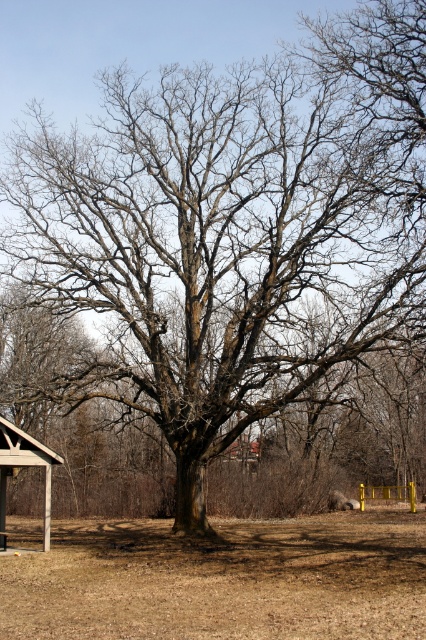
Is brown dry soil at center further to the viewer compared to wooden picnic table at lower left?

No, brown dry soil at center is in front of wooden picnic table at lower left.

Describe the element at coordinates (218, 579) in the screenshot. I see `brown dry soil at center` at that location.

Image resolution: width=426 pixels, height=640 pixels. Identify the location of brown dry soil at center. (218, 579).

Locate an element on the screen. The image size is (426, 640). brown dry soil at center is located at coordinates (218, 579).